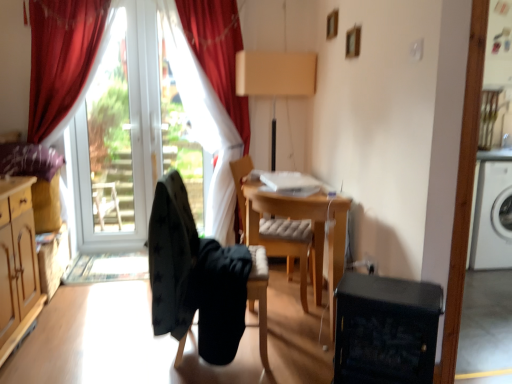
Where is `black fabric chair at center, the first chair viewed from the front`? This screenshot has width=512, height=384. black fabric chair at center, the first chair viewed from the front is located at coordinates (199, 279).

Measure the distance between black fabric chair at center, arranged as the 2th chair when viewed from the back, and camera.

black fabric chair at center, arranged as the 2th chair when viewed from the back, and camera are 6.11 feet apart.

Where is `velvet red curtain at upper left, which ranks as the 1th curtain in right-to-left order`? velvet red curtain at upper left, which ranks as the 1th curtain in right-to-left order is located at coordinates (218, 52).

What do you see at coordinates (218, 52) in the screenshot?
I see `velvet red curtain at upper left, the 2th curtain when ordered from left to right` at bounding box center [218, 52].

The image size is (512, 384). Describe the element at coordinates (385, 330) in the screenshot. I see `black plastic dishwasher at lower right` at that location.

The width and height of the screenshot is (512, 384). Describe the element at coordinates (204, 122) in the screenshot. I see `red velvet curtain at left, placed as the 2th curtain when sorted from right to left` at that location.

I want to click on black fabric chair at center, the first chair viewed from the front, so click(x=199, y=279).

From a real-world perspective, is wooden cushioned chair at center, which is the 1th chair in back-to-front order, physically below black plastic dishwasher at lower right?

Incorrect, from a real-world perspective, wooden cushioned chair at center, which is the 1th chair in back-to-front order, is higher than black plastic dishwasher at lower right.

Measure the distance between wooden cushioned chair at center, the second chair from the front, and black plastic dishwasher at lower right.

wooden cushioned chair at center, the second chair from the front, and black plastic dishwasher at lower right are 97.61 centimeters apart from each other.

Which object is wider, wooden cushioned chair at center, the second chair from the front, or black plastic dishwasher at lower right?

wooden cushioned chair at center, the second chair from the front.

Can you tell me how much wooden cushioned chair at center, the second chair from the front, and black plastic dishwasher at lower right differ in facing direction?

The facing directions of wooden cushioned chair at center, the second chair from the front, and black plastic dishwasher at lower right are 96.8 degrees apart.

Who is taller, white glass door at left or wooden desk at center?

white glass door at left.

Between white glass door at left and wooden desk at center, which one has smaller width?

Thinner between the two is white glass door at left.

Considering the positions of point (83, 219) and point (301, 276), is point (83, 219) closer or farther from the camera than point (301, 276)?

Clearly, point (83, 219) is more distant from the camera than point (301, 276).

Is white glass door at left located outside wooden desk at center?

white glass door at left lies outside wooden desk at center's area.

Considering the sizes of white glass door at left and red velvet curtain at left, placed as the 2th curtain when sorted from right to left, in the image, is white glass door at left taller or shorter than red velvet curtain at left, placed as the 2th curtain when sorted from right to left,?

In the image, white glass door at left appears to be shorter than red velvet curtain at left, placed as the 2th curtain when sorted from right to left.

Could red velvet curtain at left, placed as the 2th curtain when sorted from right to left, be considered to be inside white glass door at left?

Yes, red velvet curtain at left, placed as the 2th curtain when sorted from right to left, is a part of white glass door at left.

Which is less distant, (144, 129) or (132, 77)?

Point (144, 129) appears to be farther away from the viewer than point (132, 77).

Is velvet red curtain at upper left, the 2th curtain when ordered from left to right, thinner than white glass door at left?

No, velvet red curtain at upper left, the 2th curtain when ordered from left to right, is not thinner than white glass door at left.

From the image's perspective, is velvet red curtain at upper left, the 2th curtain when ordered from left to right, above white glass door at left?

No.

Looking at this image, which of these two, velvet red curtain at upper left, the 2th curtain when ordered from left to right, or white glass door at left, is smaller?

white glass door at left is smaller.

Find the location of `the 2nd curtain counting from the right of the white glass door at left`. the 2nd curtain counting from the right of the white glass door at left is located at coordinates (218, 52).

Can you see wooden desk at center touching wooden cushioned chair at center, the second chair from the front?

Yes, the surface of wooden desk at center is in contact with wooden cushioned chair at center, the second chair from the front.

From the image's perspective, would you say wooden desk at center is positioned over wooden cushioned chair at center, which is the 1th chair in back-to-front order?

Incorrect, from the image's perspective, wooden desk at center is lower than wooden cushioned chair at center, which is the 1th chair in back-to-front order.

Could wooden cushioned chair at center, which is the 1th chair in back-to-front order, be considered to be inside wooden desk at center?

Yes.

Between wooden desk at center and wooden cushioned chair at center, the second chair from the front, which one is positioned in front?

wooden desk at center is more forward.

Is black plastic dishwasher at lower right taller or shorter than black fabric chair at center, the first chair viewed from the front?

Clearly, black plastic dishwasher at lower right is shorter compared to black fabric chair at center, the first chair viewed from the front.

Does black plastic dishwasher at lower right have a lesser width compared to black fabric chair at center, arranged as the 2th chair when viewed from the back?

Yes.

Are black plastic dishwasher at lower right and black fabric chair at center, arranged as the 2th chair when viewed from the back, far apart?

No, there isn't a large distance between black plastic dishwasher at lower right and black fabric chair at center, arranged as the 2th chair when viewed from the back.

How different are the orientations of black plastic dishwasher at lower right and black fabric chair at center, the first chair viewed from the front, in degrees?

113 degrees separate the facing orientations of black plastic dishwasher at lower right and black fabric chair at center, the first chair viewed from the front.

Are black plastic dishwasher at lower right and red velvet curtain at left, which is the first curtain from left to right, located far from each other?

black plastic dishwasher at lower right is positioned a significant distance from red velvet curtain at left, which is the first curtain from left to right.

From a real-world perspective, which is physically below, black plastic dishwasher at lower right or red velvet curtain at left, placed as the 2th curtain when sorted from right to left?

black plastic dishwasher at lower right.

This screenshot has width=512, height=384. Find the location of `dish washer located below the red velvet curtain at left, which is the first curtain from left to right (from the image's perspective)`. dish washer located below the red velvet curtain at left, which is the first curtain from left to right (from the image's perspective) is located at coordinates (385, 330).

The image size is (512, 384). Find the location of `dish washer located underneath the wooden cushioned chair at center, the second chair from the front (from a real-world perspective)`. dish washer located underneath the wooden cushioned chair at center, the second chair from the front (from a real-world perspective) is located at coordinates (385, 330).

Where is `computer desk below the white glass door at left (from the image's perspective)`? computer desk below the white glass door at left (from the image's perspective) is located at coordinates (300, 234).

Based on their spatial positions, is black fabric chair at center, arranged as the 2th chair when viewed from the back, or red velvet curtain at left, placed as the 2th curtain when sorted from right to left, closer to wooden cushioned chair at center, which is the 1th chair in back-to-front order?

The object closer to wooden cushioned chair at center, which is the 1th chair in back-to-front order, is black fabric chair at center, arranged as the 2th chair when viewed from the back.

Which object lies further to the anchor point white glass door at left, black fabric chair at center, the first chair viewed from the front, or wooden desk at center?

The object further to white glass door at left is black fabric chair at center, the first chair viewed from the front.

Estimate the real-world distances between objects in this image. Which object is closer to velvet red curtain at upper left, which ranks as the 1th curtain in right-to-left order, red velvet curtain at left, placed as the 2th curtain when sorted from right to left, or wooden cushioned chair at center, the second chair from the front?

red velvet curtain at left, placed as the 2th curtain when sorted from right to left.

Which object lies nearer to the anchor point black fabric chair at center, the first chair viewed from the front, velvet red curtain at upper left, which ranks as the 1th curtain in right-to-left order, or wooden desk at center?

wooden desk at center lies closer to black fabric chair at center, the first chair viewed from the front, than the other object.

Looking at the image, which one is located further to wooden desk at center, wooden cushioned chair at center, the second chair from the front, or red velvet curtain at left, which is the first curtain from left to right?

The object further to wooden desk at center is red velvet curtain at left, which is the first curtain from left to right.

From the image, which object appears to be farther from velvet red curtain at upper left, which ranks as the 1th curtain in right-to-left order, red velvet curtain at left, which is the first curtain from left to right, or black plastic dishwasher at lower right?

Based on the image, black plastic dishwasher at lower right appears to be further to velvet red curtain at upper left, which ranks as the 1th curtain in right-to-left order.

Estimate the real-world distances between objects in this image. Which object is closer to wooden cushioned chair at center, the second chair from the front, velvet red curtain at upper left, which ranks as the 1th curtain in right-to-left order, or white glass door at left?

Based on the image, velvet red curtain at upper left, which ranks as the 1th curtain in right-to-left order, appears to be nearer to wooden cushioned chair at center, the second chair from the front.

From the image, which object appears to be nearer to wooden cushioned chair at center, the second chair from the front, red velvet curtain at left, which is the first curtain from left to right, or velvet red curtain at upper left, the 2th curtain when ordered from left to right?

Among the two, red velvet curtain at left, which is the first curtain from left to right, is located nearer to wooden cushioned chair at center, the second chair from the front.

At what (x,y) coordinates should I click in order to perform the action: click on computer desk positioned between black plastic dishwasher at lower right and velvet red curtain at upper left, the 2th curtain when ordered from left to right, from near to far. Please return your answer as a coordinate pair (x, y). Looking at the image, I should click on (300, 234).

I want to click on computer desk between white glass door at left and black plastic dishwasher at lower right, so click(300, 234).

Locate an element on the screen. The image size is (512, 384). computer desk between black fabric chair at center, arranged as the 2th chair when viewed from the back, and white glass door at left from front to back is located at coordinates (300, 234).

This screenshot has width=512, height=384. In order to click on window screen positioned between black plastic dishwasher at lower right and red velvet curtain at left, which is the first curtain from left to right, from near to far in this screenshot , I will do `click(113, 140)`.